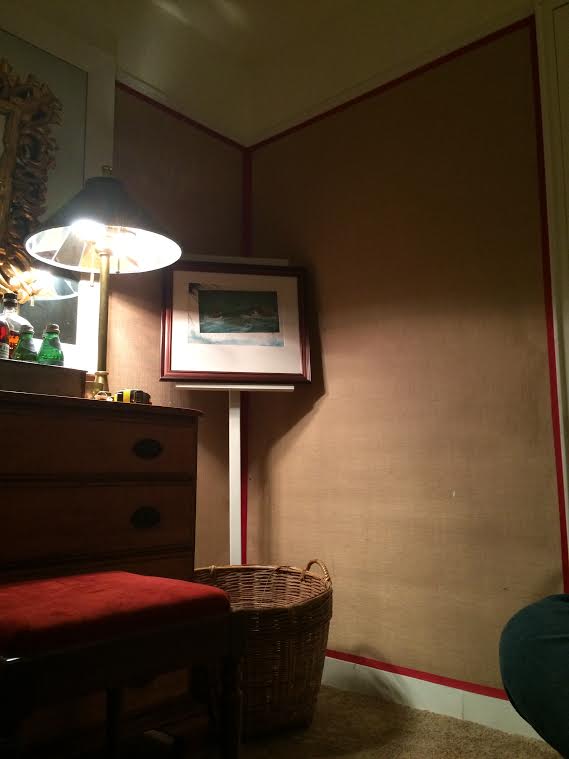
Locate an element on the screen. woven basket is located at coordinates (286, 638).